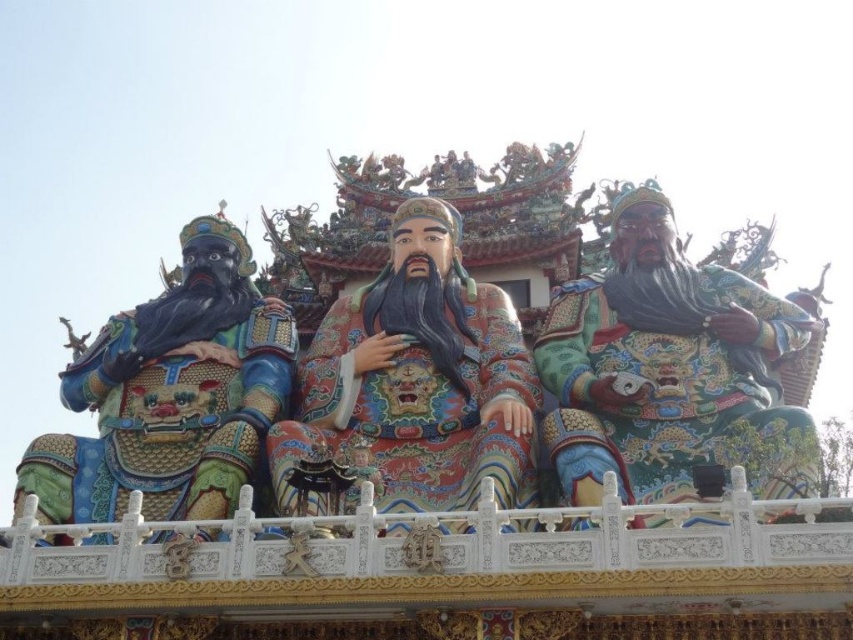
Consider the image. Based on the scene description, which object is located at the coordinates point (410, 387)?

The polychrome painted statue at center is located at point (410, 387).

You are an art conservator examining the statues. You need to inspect the shiny green armor at right and the multicolored painted statue at left. According to the scene, which statue is positioned to the east side?

The shiny green armor at right is positioned to the east side because it is to the right of the multicolored painted statue at left, and assuming the scene is oriented with left as west and right as east.

You are standing in front of the statues and want to touch the shiny green armor at right. Based on the coordinates provided, where exactly would your hand land if you reach out to the point at [668,369]?

The point at [668,369] is on the shiny green armor at right, so your hand would land on the shiny green armor at right.